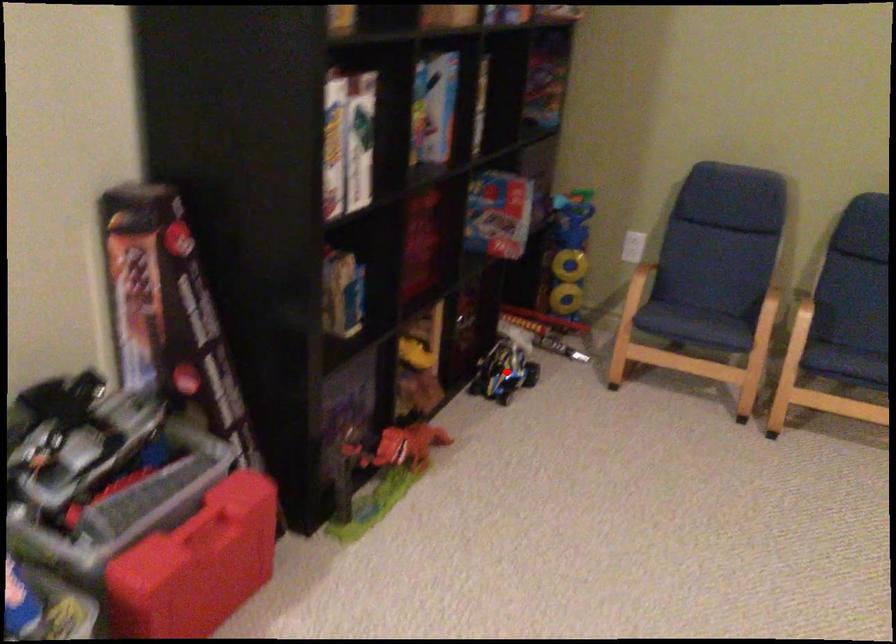
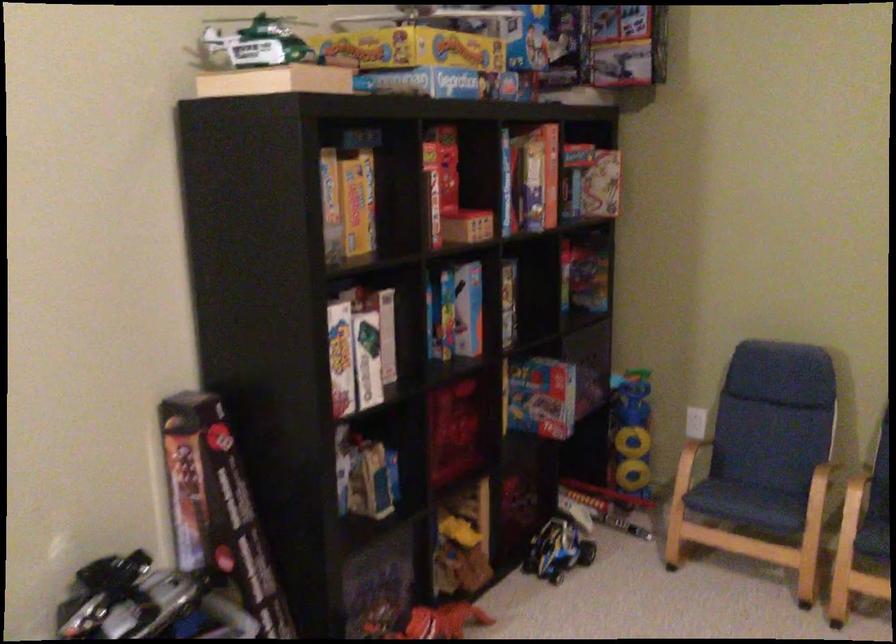
The point at the highlighted location is marked in the first image. Where is the corresponding point in the second image?

(557, 550)